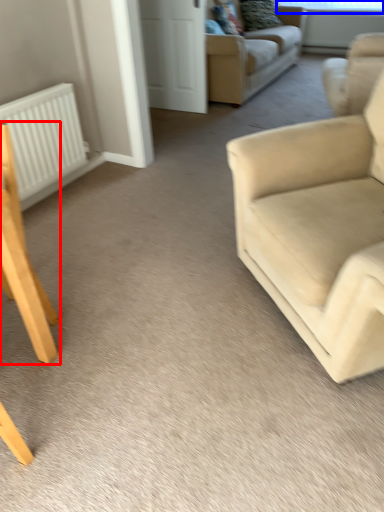
Question: Which of the following is the farthest to the observer, chair (highlighted by a red box) or window screen (highlighted by a blue box)?

Choices:
 (A) chair
 (B) window screen

Answer: (B)